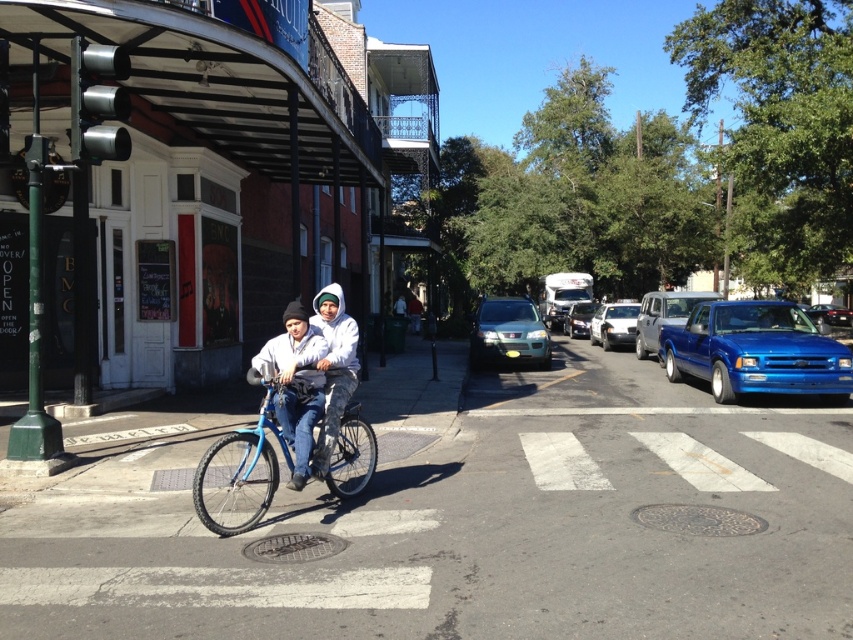
Question: Estimate the real-world distances between objects in this image. Which object is closer to the blue metallic bicycle at center?

Choices:
 (A) silver metallic suv at center
 (B) white fleece jacket at center
 (C) blue metallic truck at center-right

Answer: (B)

Question: Is white matte sedan at center bigger than shiny blue truck at right?

Choices:
 (A) no
 (B) yes

Answer: (B)

Question: Does blue metallic bicycle at center lie in front of white matte jacket at center?

Choices:
 (A) yes
 (B) no

Answer: (A)

Question: Is blue metallic truck at center-right closer to the viewer compared to white matte sedan at center?

Choices:
 (A) no
 (B) yes

Answer: (B)

Question: Which point appears farthest from the camera in this image?

Choices:
 (A) (517, 308)
 (B) (631, 312)
 (C) (297, 364)

Answer: (B)

Question: Which point is closer to the camera?

Choices:
 (A) (264, 497)
 (B) (570, 308)
 (C) (851, 316)
 (D) (605, 308)

Answer: (A)